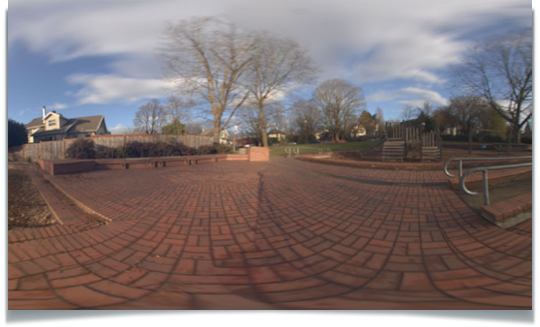
Locate an element on the screen. Image resolution: width=540 pixels, height=327 pixels. benches is located at coordinates (71, 164), (123, 161), (175, 161), (217, 156).